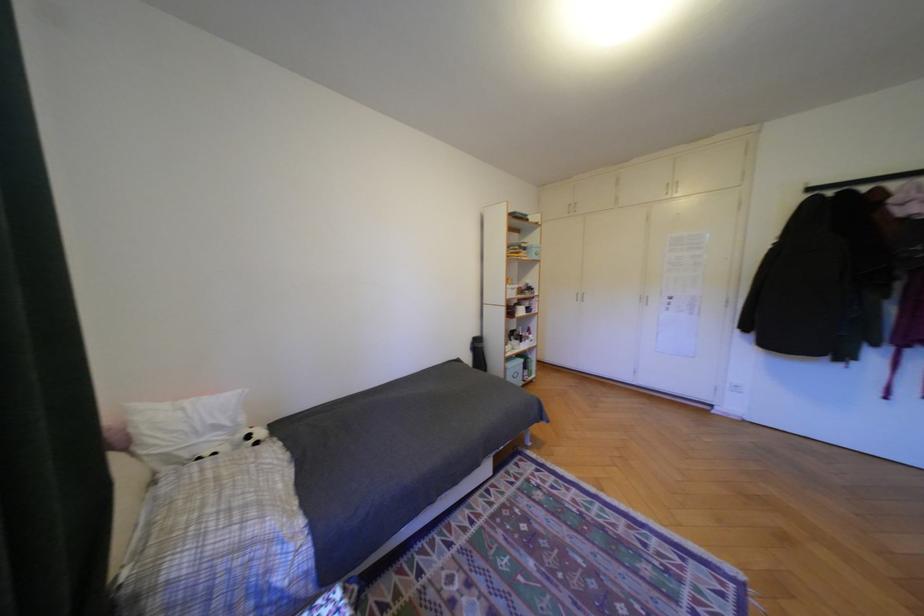
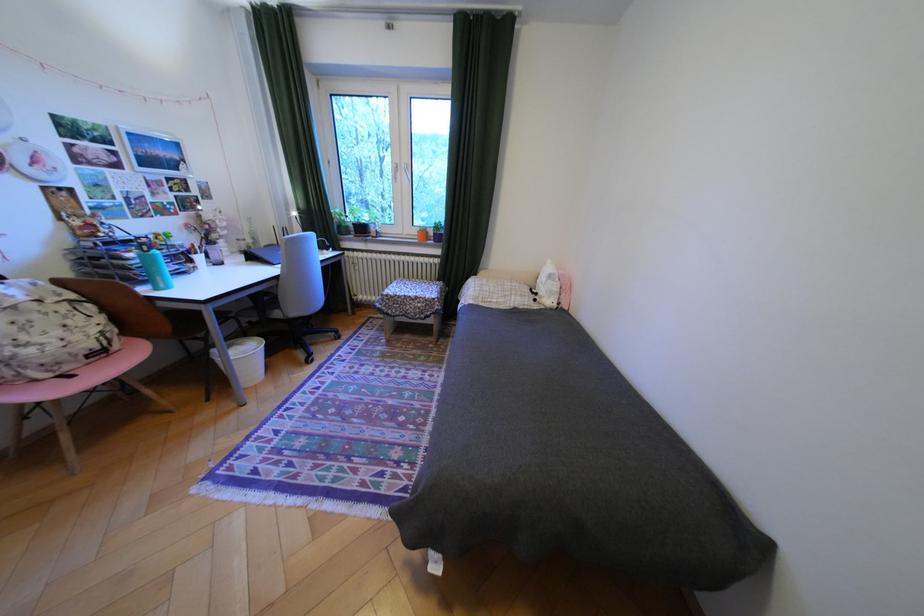
Locate, in the second image, the point that corresponds to pixel 261 437 in the first image.

(548, 294)